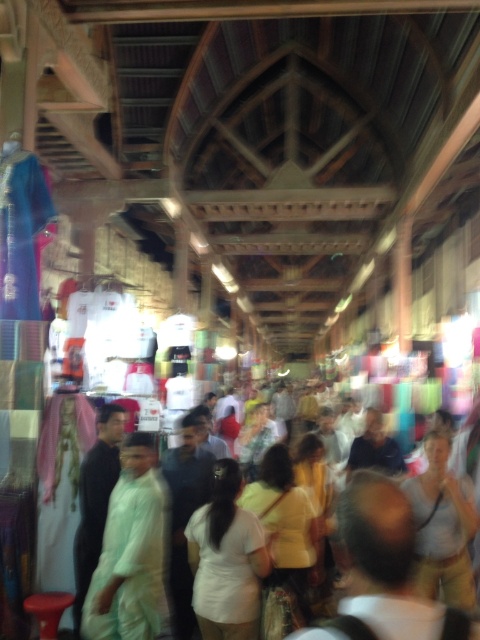
Question: Among these objects, which one is farthest from the camera?

Choices:
 (A) white cotton crowd at center
 (B) white matte shirt at center

Answer: (A)

Question: Which object is farther from the camera taking this photo?

Choices:
 (A) light green fabric at center
 (B) white matte shirt at center
 (C) white cotton crowd at center

Answer: (C)

Question: Is the position of light green fabric at center more distant than that of white matte shirt at center?

Choices:
 (A) no
 (B) yes

Answer: (A)

Question: Does light green fabric at center appear under white matte shirt at center?

Choices:
 (A) yes
 (B) no

Answer: (B)

Question: Which is nearer to the white cotton crowd at center?

Choices:
 (A) white matte shirt at center
 (B) light green fabric at center

Answer: (A)

Question: Is light green fabric at center to the left of white matte shirt at center from the viewer's perspective?

Choices:
 (A) yes
 (B) no

Answer: (A)